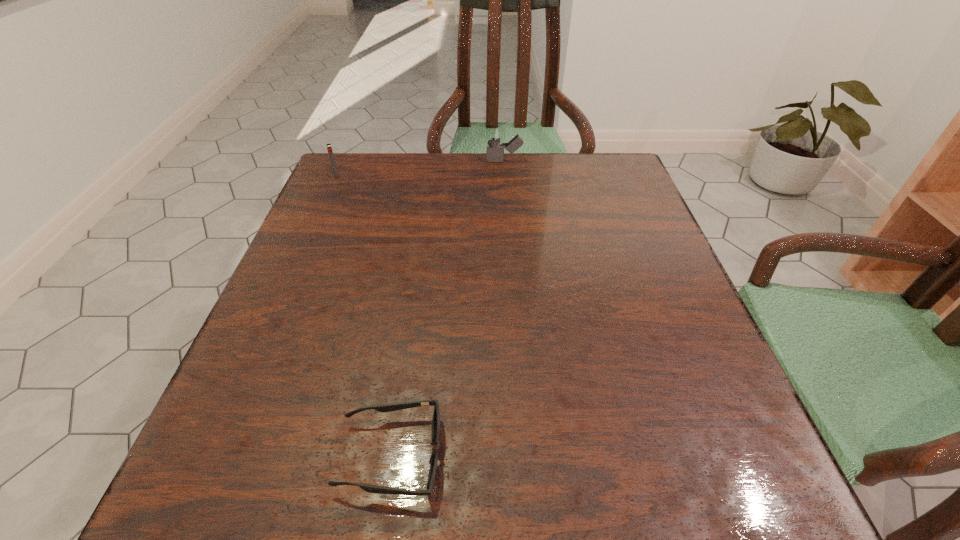
I want to click on free space between the shorter igniter and the farther igniter, so click(x=420, y=168).

Locate an element on the screen. vacant area between the taller igniter and the leftmost object is located at coordinates (x=420, y=168).

Where is `vacant area that lies between the right igniter and the nearer igniter`? The height and width of the screenshot is (540, 960). vacant area that lies between the right igniter and the nearer igniter is located at coordinates (420, 168).

The image size is (960, 540). I want to click on vacant point located between the sunglasses and the leftmost object, so (364, 315).

Find the location of a particular element. vacant area that lies between the shortest object and the second tallest object is located at coordinates 364,315.

Locate an element on the screen. The image size is (960, 540). free point between the second object from right to left and the farther igniter is located at coordinates (447, 308).

At what (x,y) coordinates should I click in order to perform the action: click on vacant space that's between the tallest object and the second farthest object. Please return your answer as a coordinate pair (x, y). Image resolution: width=960 pixels, height=540 pixels. Looking at the image, I should click on (420, 168).

Locate an element on the screen. The width and height of the screenshot is (960, 540). free space between the nearer igniter and the taller igniter is located at coordinates tap(420, 168).

This screenshot has width=960, height=540. Identify the location of vacant space in between the shorter igniter and the nearest object. (364, 315).

Image resolution: width=960 pixels, height=540 pixels. I want to click on vacant region between the second object from right to left and the nearer igniter, so click(364, 315).